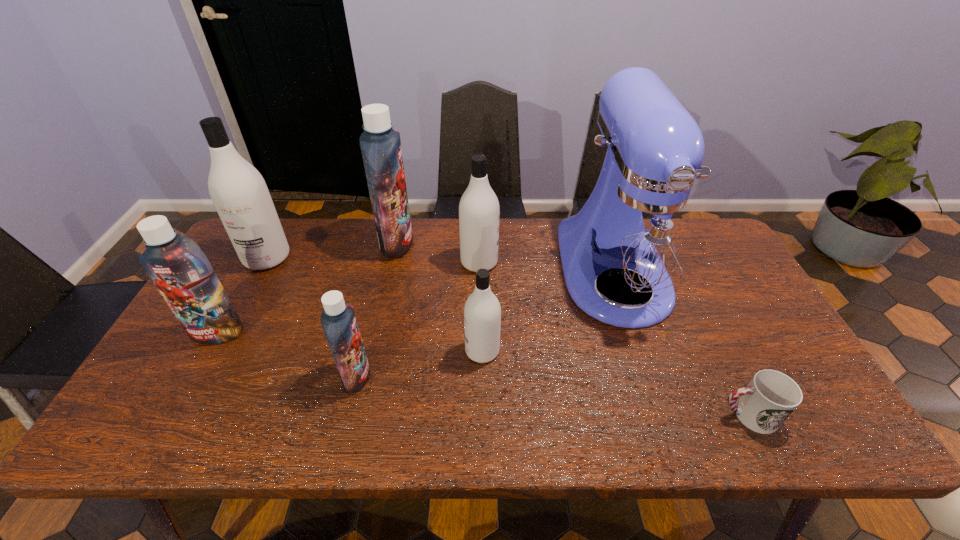
The height and width of the screenshot is (540, 960). In order to click on empty space between the second biggest blue shampoo and the blue mixer in this screenshot , I will do `click(416, 302)`.

Identify which object is the third nearest to the blue mixer. Please provide its 2D coordinates. Your answer should be formatted as a tuple, i.e. [(x, y)], where the tuple contains the x and y coordinates of a point satisfying the conditions above.

[(482, 313)]

What are the coordinates of `the second closest object to the biggest blue shampoo` in the screenshot? It's located at (239, 193).

Image resolution: width=960 pixels, height=540 pixels. What are the coordinates of `shampoo that can be found as the fifth closest to the second smallest white shampoo` in the screenshot? It's located at tap(176, 265).

Locate an element on the screen. The width and height of the screenshot is (960, 540). shampoo that is the fourth closest one to the leftmost blue shampoo is located at coordinates [x=482, y=313].

Find the location of a particular element. The width and height of the screenshot is (960, 540). blue shampoo that is the second closest to the second biggest blue shampoo is located at coordinates (380, 145).

At what (x,y) coordinates should I click in order to perform the action: click on blue shampoo that can be found as the second closest to the nearest object. Please return your answer as a coordinate pair (x, y). Looking at the image, I should click on (380, 145).

Image resolution: width=960 pixels, height=540 pixels. Find the location of `white shampoo that is the third closest to the second nearest blue shampoo`. white shampoo that is the third closest to the second nearest blue shampoo is located at coordinates (479, 211).

Identify the location of white shampoo that can be found as the third closest to the farthest blue shampoo. (482, 313).

I want to click on vacant space that satisfies the following two spatial constraints: 1. on the front label of the farthest blue shampoo; 2. on the side of the shortest object where the handle is located, so click(x=359, y=415).